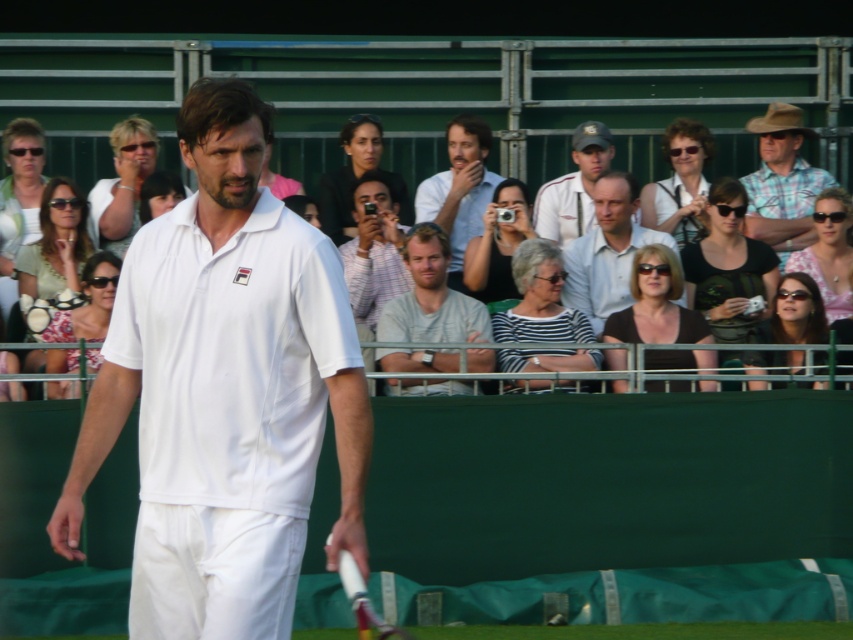
You are a photographer at the tennis court and want to capture the black matte tank top at center and the pink fabric at center in the same frame. Which one is positioned higher in the image?

The black matte tank top at center is above the pink fabric at center, so it is positioned higher in the image.

You are a tennis player who just finished a match and need to place your light gray cotton shirt at center and matte white shirt at center into a bag. The bag has a maximum capacity of 1 meter. Can both shirts fit in the bag without overlapping?

The distance between the light gray cotton shirt at center and matte white shirt at center is 92.47 centimeters, which is less than 1 meter. Therefore, both shirts can fit into the bag without overlapping.